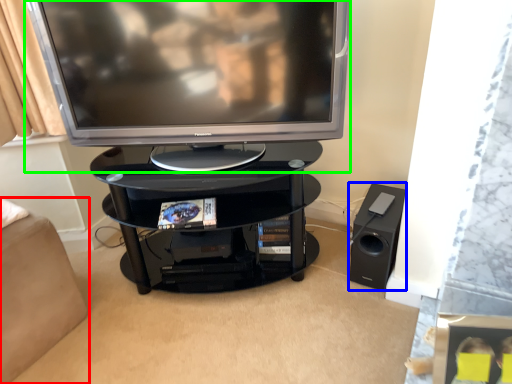
Question: Estimate the real-world distances between objects in this image. Which object is farther from furniture (highlighted by a red box), speaker (highlighted by a blue box) or television (highlighted by a green box)?

Choices:
 (A) speaker
 (B) television

Answer: (A)